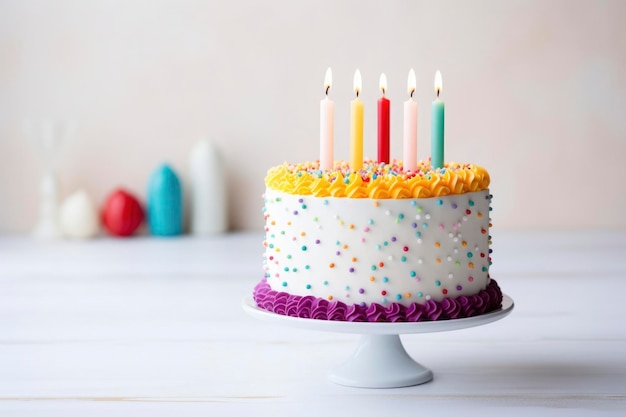
At what (x,y) coordinates should I click in order to perform the action: click on birthday candles. Please return your answer as a coordinate pair (x, y). This screenshot has width=626, height=417. Looking at the image, I should click on (326, 115), (352, 121), (385, 117), (412, 119), (442, 125).